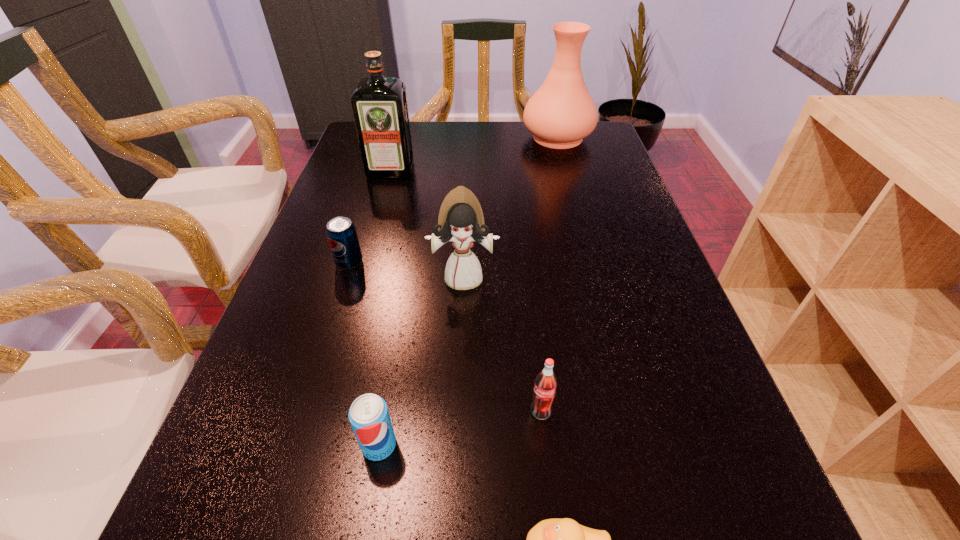
Locate which object ranks second in proximity to the second nearest object. Please provide its 2D coordinates. Your answer should be formatted as a tuple, i.e. [(x, y)], where the tuple contains the x and y coordinates of a point satisfying the conditions above.

[(544, 391)]

The width and height of the screenshot is (960, 540). I want to click on object that can be found as the sixth closest to the sixth farthest object, so click(x=561, y=113).

Locate an element on the screen. Image resolution: width=960 pixels, height=540 pixels. soda can that is the second closest to the rightmost soda can is located at coordinates (341, 233).

Identify which soda can is located as the second nearest to the liquor. Please provide its 2D coordinates. Your answer should be formatted as a tuple, i.e. [(x, y)], where the tuple contains the x and y coordinates of a point satisfying the conditions above.

[(369, 417)]

Identify the location of free location that satisfies the following two spatial constraints: 1. on the back side of the farthest object; 2. on the left side of the second nearest object. (431, 137).

At what (x,y) coordinates should I click in order to perform the action: click on vacant area in the image that satisfies the following two spatial constraints: 1. on the front side of the second nearest object; 2. on the right side of the farthest soda can. Please return your answer as a coordinate pair (x, y). The width and height of the screenshot is (960, 540). Looking at the image, I should click on (292, 445).

At what (x,y) coordinates should I click in order to perform the action: click on free space that satisfies the following two spatial constraints: 1. on the front label of the liquor; 2. on the left side of the nearest soda can. Please return your answer as a coordinate pair (x, y). The width and height of the screenshot is (960, 540). Looking at the image, I should click on (313, 445).